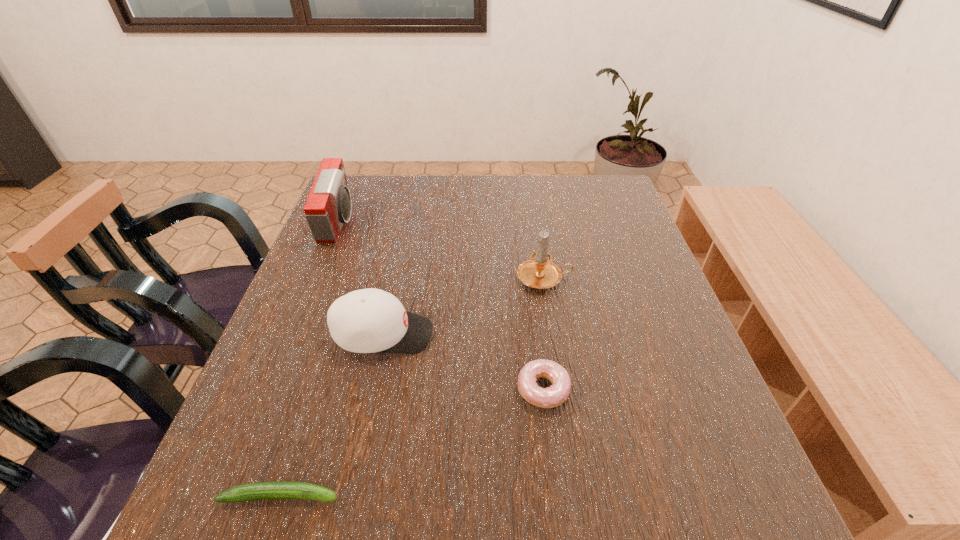
Locate an element on the screen. The image size is (960, 540). camera is located at coordinates (328, 206).

This screenshot has height=540, width=960. Find the location of `candle`. candle is located at coordinates (539, 272).

Identify the location of the third nearest object. (370, 320).

Locate an element on the screen. This screenshot has height=540, width=960. the third shortest object is located at coordinates (370, 320).

Identify the location of doughnut. (553, 396).

This screenshot has height=540, width=960. Find the location of `the second shortest object`. the second shortest object is located at coordinates 553,396.

You are a GUI agent. You are given a task and a screenshot of the screen. Output one action in this format:
    pyautogui.click(x=<x>, y=<y>)
    Task: Click on the shortest object
    The width and height of the screenshot is (960, 540).
    Given the screenshot: What is the action you would take?
    pyautogui.click(x=262, y=490)

Identify the location of zucchini. (262, 490).

I want to click on vacant space located 0.120m on the front-facing side of the farthest object, so 396,223.

Where is `free location located on the back of the second farthest object`? The width and height of the screenshot is (960, 540). free location located on the back of the second farthest object is located at coordinates (536, 224).